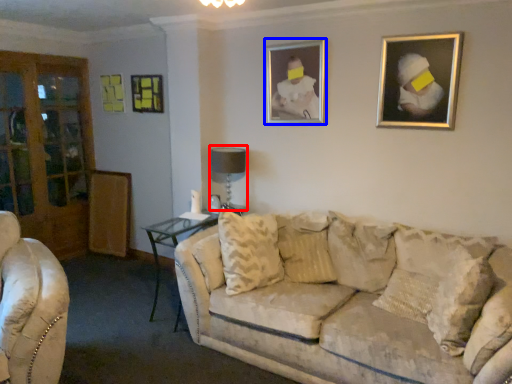
Question: Which object is further to the camera taking this photo, table lamp (highlighted by a red box) or picture frame (highlighted by a blue box)?

Choices:
 (A) table lamp
 (B) picture frame

Answer: (A)